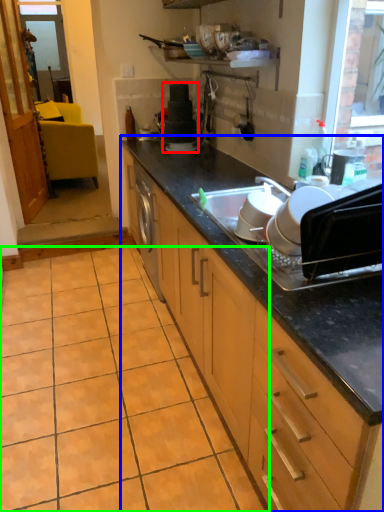
Question: Based on their relative distances, which object is farther from appliance (highlighted by a red box)? Choose from cabinetry (highlighted by a blue box) and ceramic tile (highlighted by a green box).

Choices:
 (A) cabinetry
 (B) ceramic tile

Answer: (B)